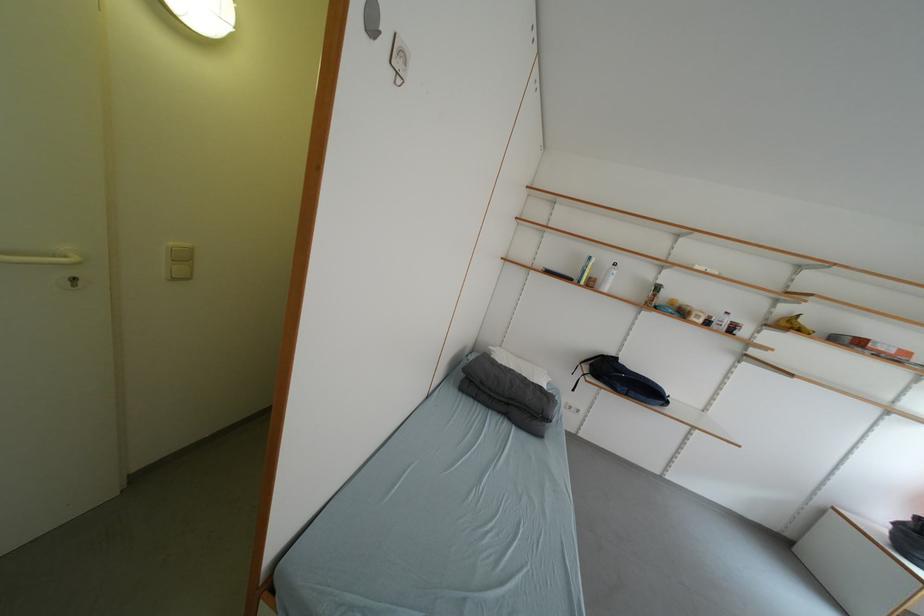
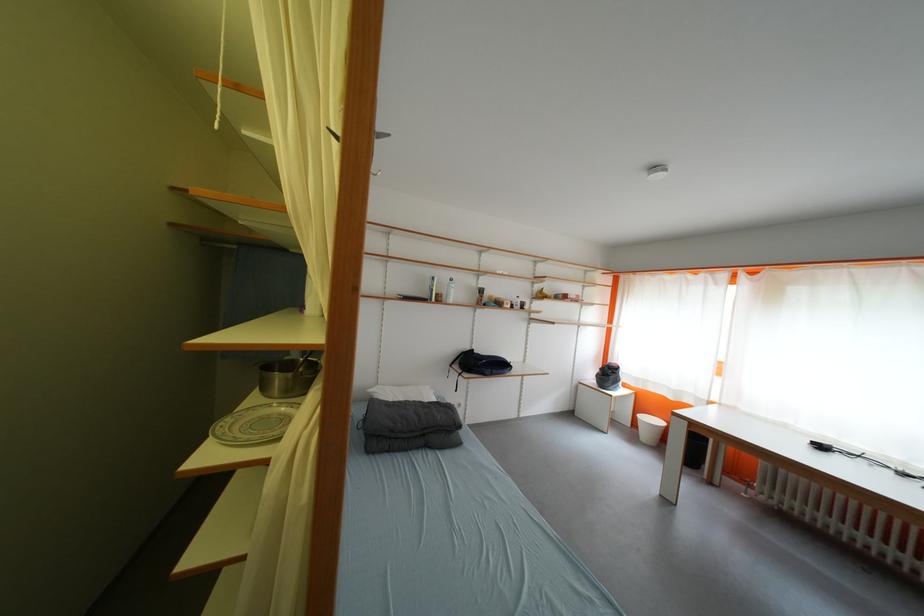
Find the pixel in the second image that matches (593,370) in the first image.

(466, 370)